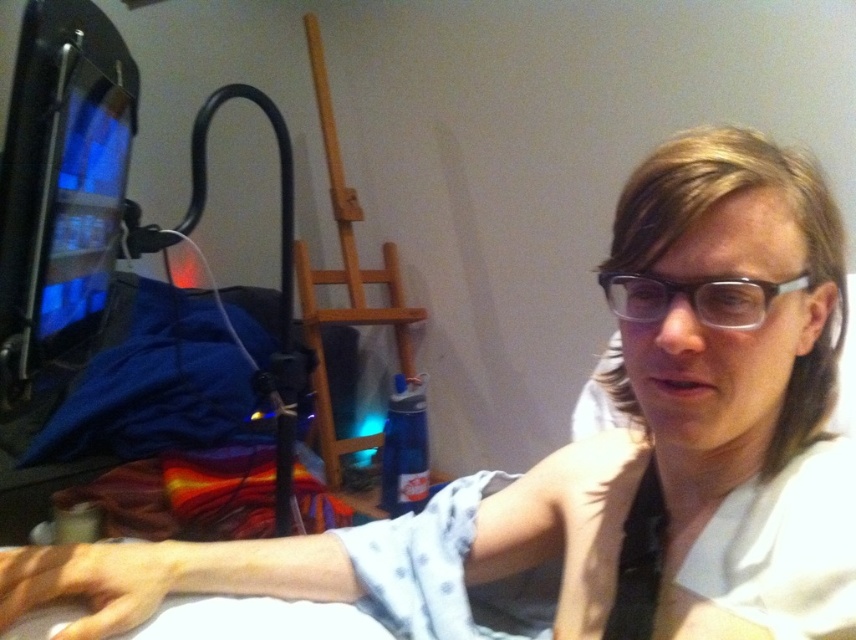
Is point (100, 129) positioned behind point (777, 291)?

Yes, point (100, 129) is behind point (777, 291).

Does matte black monitor at left have a lesser height compared to clear plastic glasses at center?

No, matte black monitor at left is not shorter than clear plastic glasses at center.

Between point (85, 164) and point (658, 312), which one is positioned behind?

Positioned behind is point (85, 164).

This screenshot has height=640, width=856. Identify the location of matte black monitor at left. (75, 209).